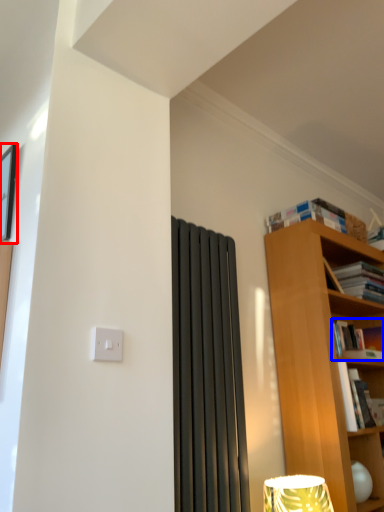
Question: Which point is further to the camera, picture frame (highlighted by a red box) or book (highlighted by a blue box)?

Choices:
 (A) picture frame
 (B) book

Answer: (B)